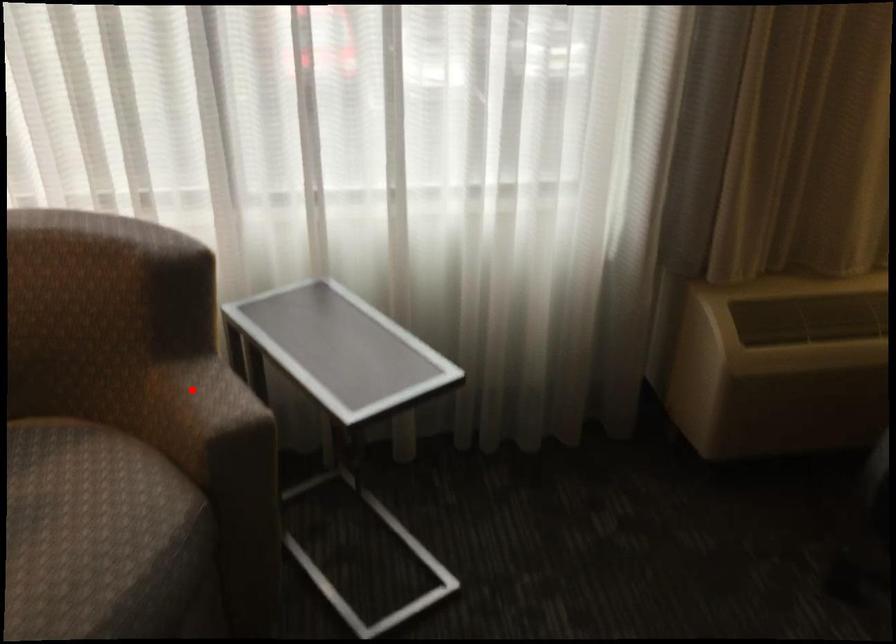
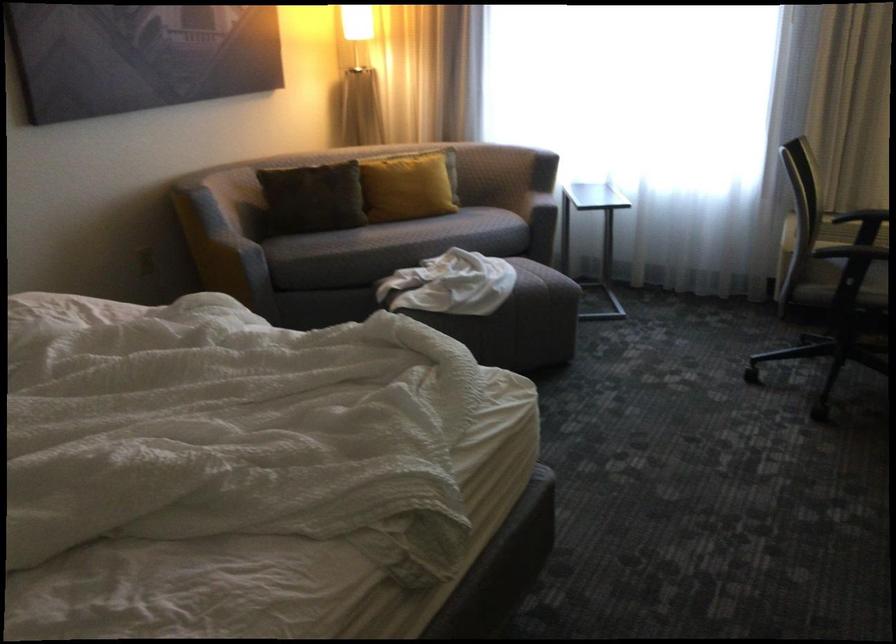
Locate, in the second image, the point that corresponds to the highlighted location in the first image.

(538, 194)